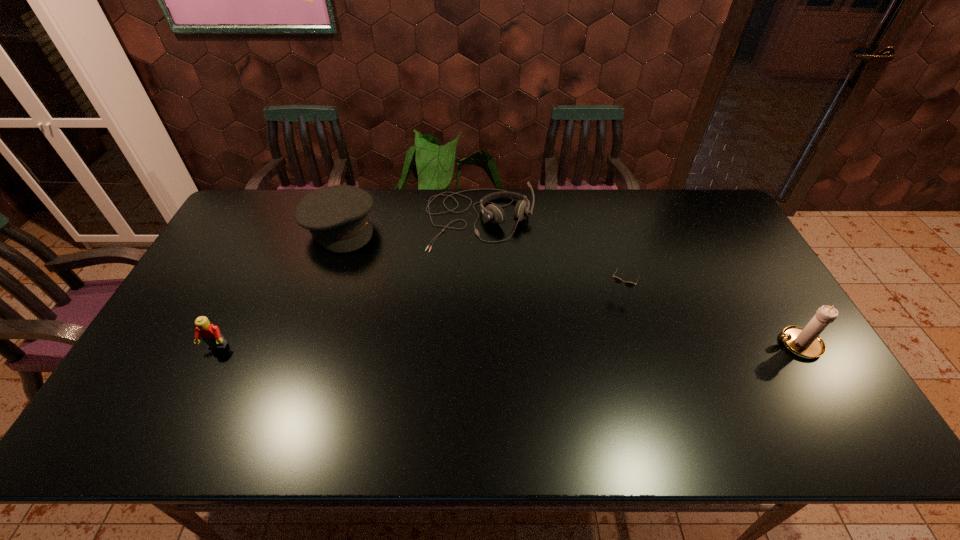
You are a GUI agent. You are given a task and a screenshot of the screen. Output one action in this format:
    pyautogui.click(x=<x>, y=<y>)
    Task: Click on the beret present at the far edge
    
    Given the screenshot: What is the action you would take?
    pyautogui.click(x=337, y=217)

The height and width of the screenshot is (540, 960). Identify the location of headset at the far edge. (493, 212).

In order to click on object that is at the left edge in this screenshot , I will do `click(210, 334)`.

Find the location of a particular element. object that is at the right edge is located at coordinates (805, 342).

Where is `free location at the far edge`? This screenshot has height=540, width=960. free location at the far edge is located at coordinates pyautogui.click(x=436, y=230).

I want to click on free location at the near edge, so click(x=598, y=391).

In the image, there is a desktop. Where is `vacant space at the right edge`? The width and height of the screenshot is (960, 540). vacant space at the right edge is located at coordinates (738, 271).

This screenshot has width=960, height=540. I want to click on free space at the far left corner, so click(x=259, y=195).

This screenshot has width=960, height=540. Find the location of `free spot at the far right corner of the desktop`. free spot at the far right corner of the desktop is located at coordinates (686, 190).

Where is `free space between the third object from right to left and the beret`? This screenshot has width=960, height=540. free space between the third object from right to left and the beret is located at coordinates (410, 223).